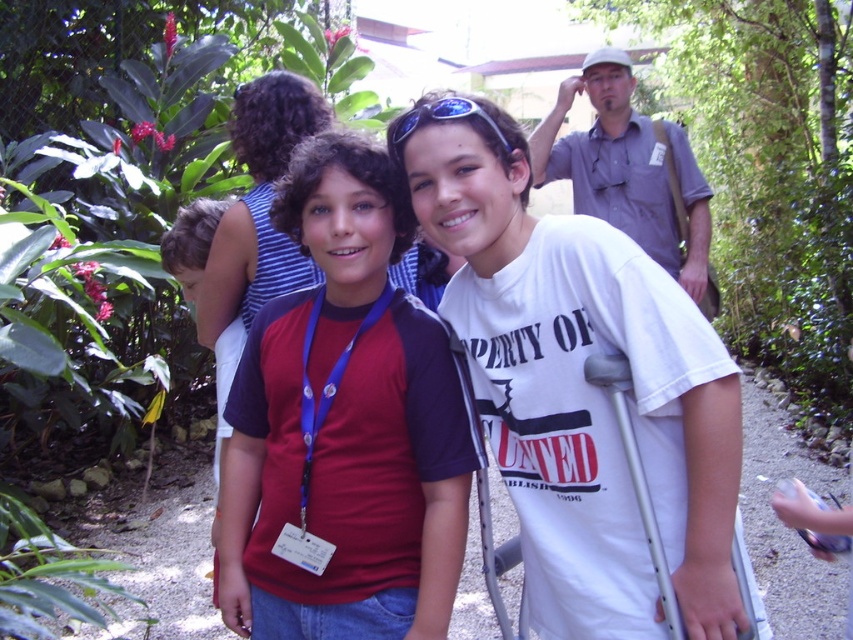
Question: Is blue striped shirt at center wider than blue reflective sunglasses at center?

Choices:
 (A) yes
 (B) no

Answer: (A)

Question: Which of the following is the farthest from the observer?

Choices:
 (A) (332, 454)
 (B) (263, 120)
 (C) (453, 116)
 (D) (608, 64)

Answer: (D)

Question: Which point appears closest to the camera in this image?

Choices:
 (A) (463, 100)
 (B) (666, 168)
 (C) (296, 176)

Answer: (A)

Question: Which point appears farthest from the camera in this image?

Choices:
 (A) (589, 131)
 (B) (399, 125)
 (C) (321, 440)

Answer: (A)

Question: Is the position of gray shirt at upper center less distant than that of blue reflective sunglasses at center?

Choices:
 (A) no
 (B) yes

Answer: (A)

Question: Does matte red shirt at center lie in front of blue reflective sunglasses at center?

Choices:
 (A) yes
 (B) no

Answer: (B)